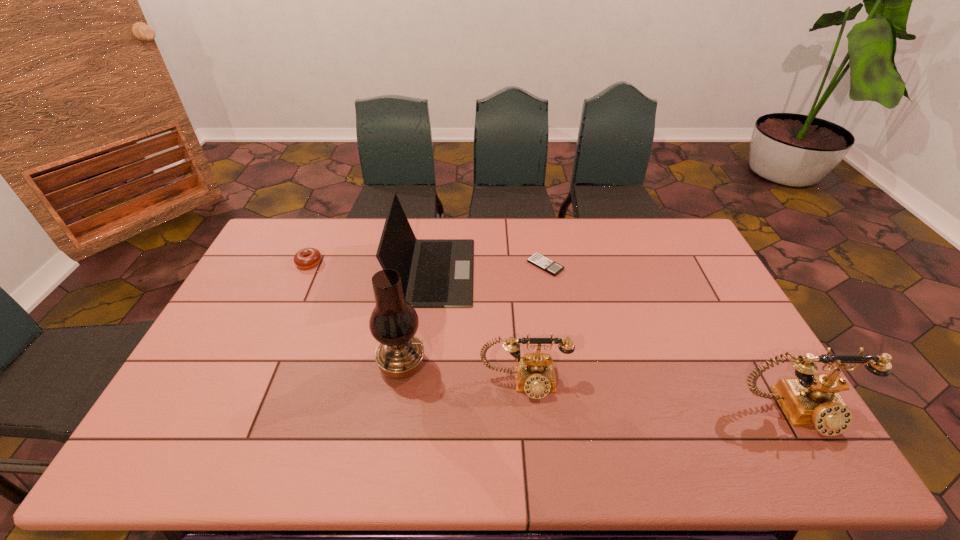
Where is `vacant spot to place a telephone on the left`? This screenshot has width=960, height=540. vacant spot to place a telephone on the left is located at coordinates (281, 356).